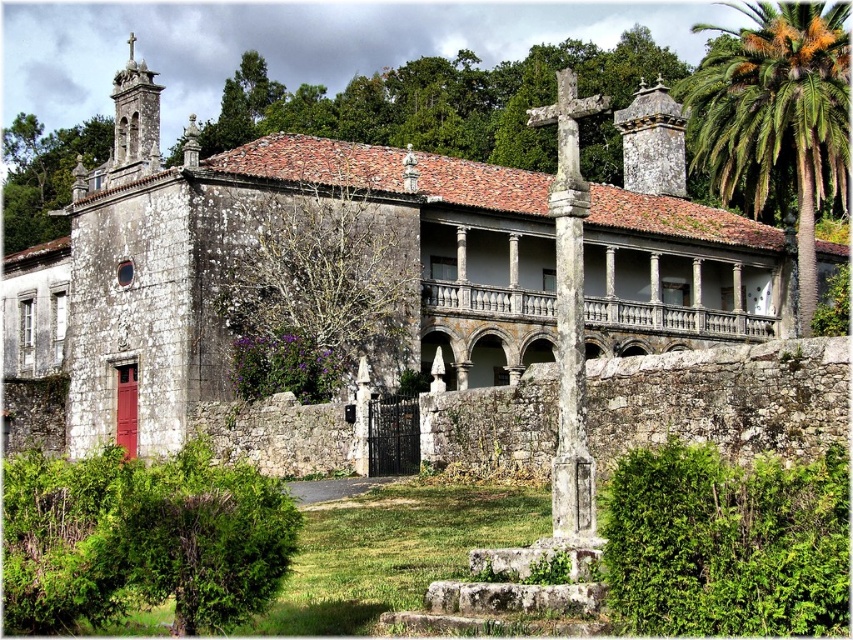
Question: Estimate the real-world distances between objects in this image. Which object is farther from the green leafy palm at upper right?

Choices:
 (A) stone church at center
 (B) stone cross at center

Answer: (B)

Question: Does stone church at center appear under stone cross at center?

Choices:
 (A) yes
 (B) no

Answer: (B)

Question: Based on their relative distances, which object is farther from the green leafy palm at upper right?

Choices:
 (A) stone church at center
 (B) stone cross at center

Answer: (B)

Question: Does stone church at center appear under green leafy palm at upper right?

Choices:
 (A) yes
 (B) no

Answer: (A)

Question: Is stone church at center positioned before green leafy palm at upper right?

Choices:
 (A) no
 (B) yes

Answer: (B)

Question: Which object appears farthest from the camera in this image?

Choices:
 (A) stone church at center
 (B) stone cross at center

Answer: (A)